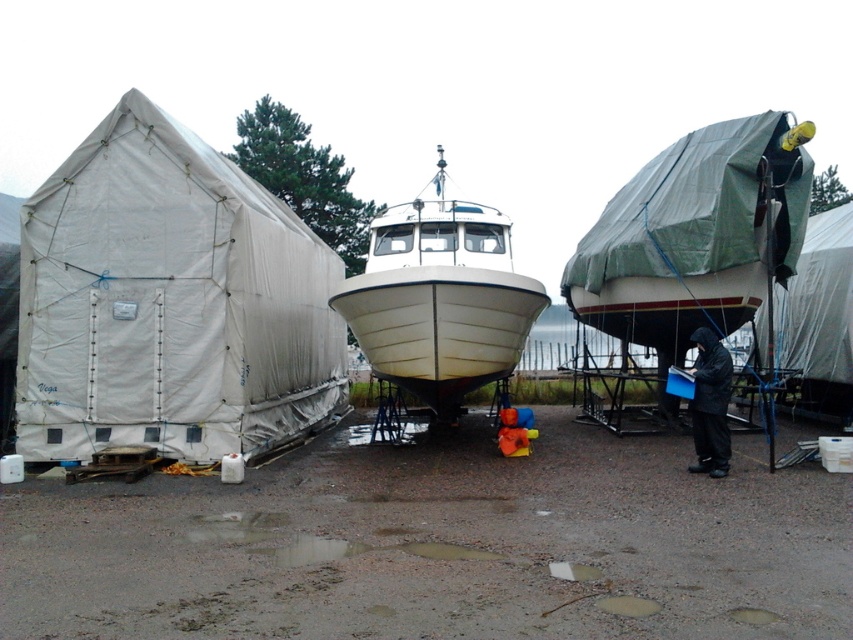
Question: Is white fabric tent at left positioned behind white matte boat at center?

Choices:
 (A) no
 (B) yes

Answer: (A)

Question: Which point appears closest to the camera in this image?

Choices:
 (A) (840, 221)
 (B) (700, 428)

Answer: (B)

Question: Which of the following is the closest to the observer?

Choices:
 (A) (126, 362)
 (B) (511, 339)
 (C) (698, 394)
 (D) (792, 387)

Answer: (C)

Question: Which object appears closest to the camera in this image?

Choices:
 (A) white matte boat at center
 (B) black matte jacket at lower right

Answer: (B)

Question: Does white fabric tent at left have a smaller size compared to white matte boat at center?

Choices:
 (A) yes
 (B) no

Answer: (A)

Question: Is green tarpaulin tent at center closer to camera compared to black matte jacket at lower right?

Choices:
 (A) yes
 (B) no

Answer: (B)